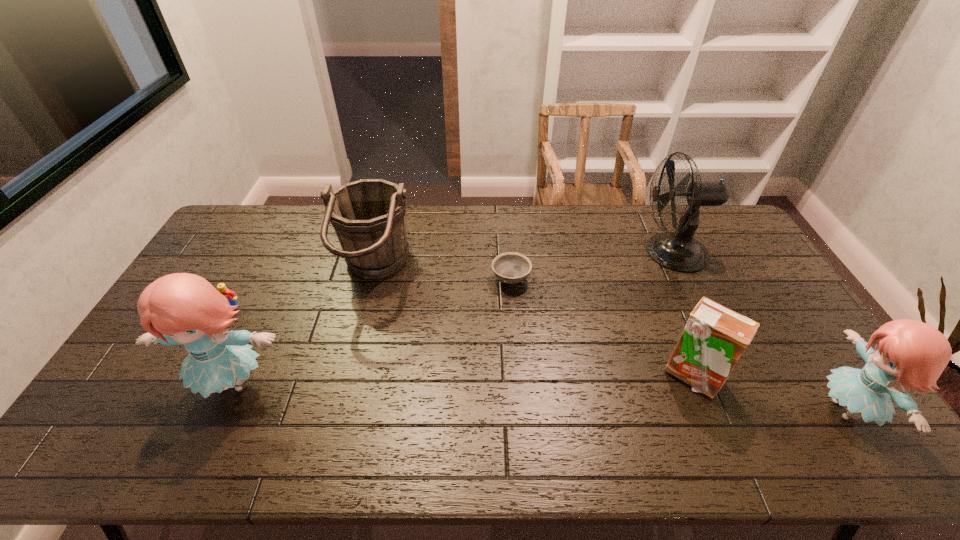
At what (x,y) coordinates should I click in order to perform the action: click on the left doll. Please return your answer as a coordinate pair (x, y). Looking at the image, I should click on (185, 309).

Identify the location of the rightmost object. (911, 354).

I want to click on the right doll, so click(911, 354).

Find the location of a particular element. fan is located at coordinates (678, 251).

Locate an element on the screen. This screenshot has height=540, width=960. the fourth object from right to left is located at coordinates (511, 268).

Locate an element on the screen. The image size is (960, 540). the shortest object is located at coordinates (511, 268).

The width and height of the screenshot is (960, 540). Find the location of `the fifth object from right to left`. the fifth object from right to left is located at coordinates (369, 216).

Where is `the second shortest object`? the second shortest object is located at coordinates (230, 295).

Find the location of a particular element. This screenshot has width=960, height=540. the fifth tallest object is located at coordinates (714, 338).

Image resolution: width=960 pixels, height=540 pixels. I want to click on free space located 0.300m on the front-facing side of the rightmost object, so click(x=696, y=410).